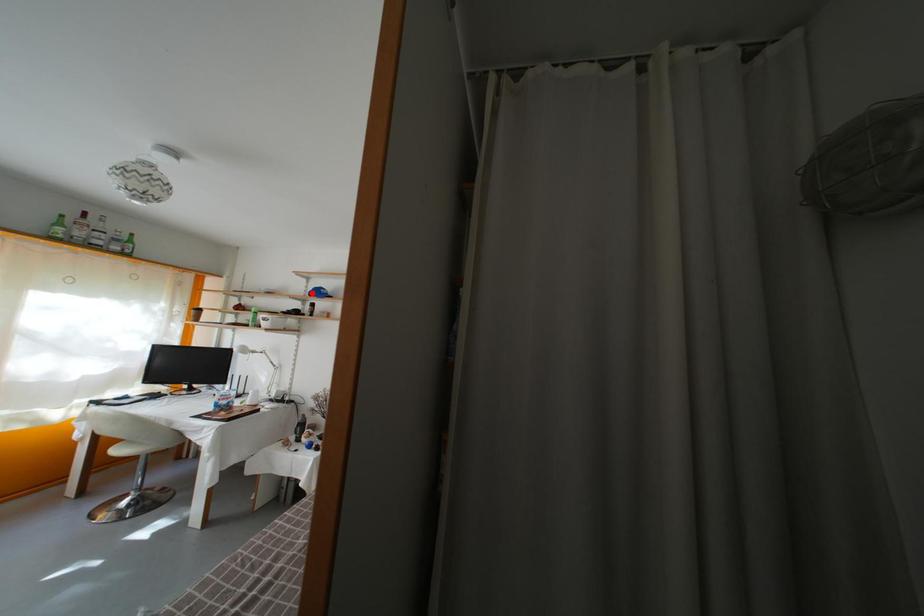
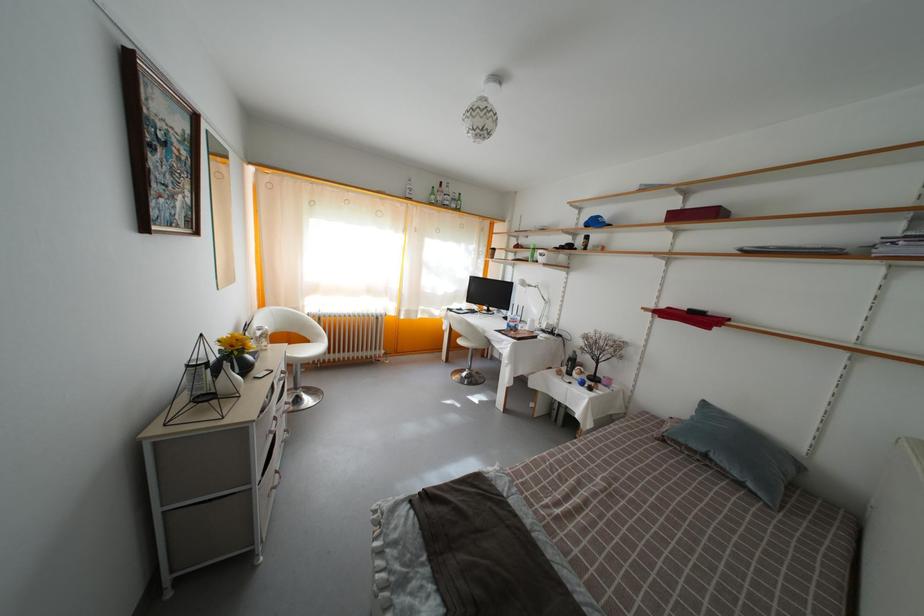
Question: I am providing you with two images of the same scene from different viewpoints. A red point is marked on the first image. At the location where the point appears in image 1, is it still visible in image 2?

Choices:
 (A) Yes
 (B) No

Answer: (A)